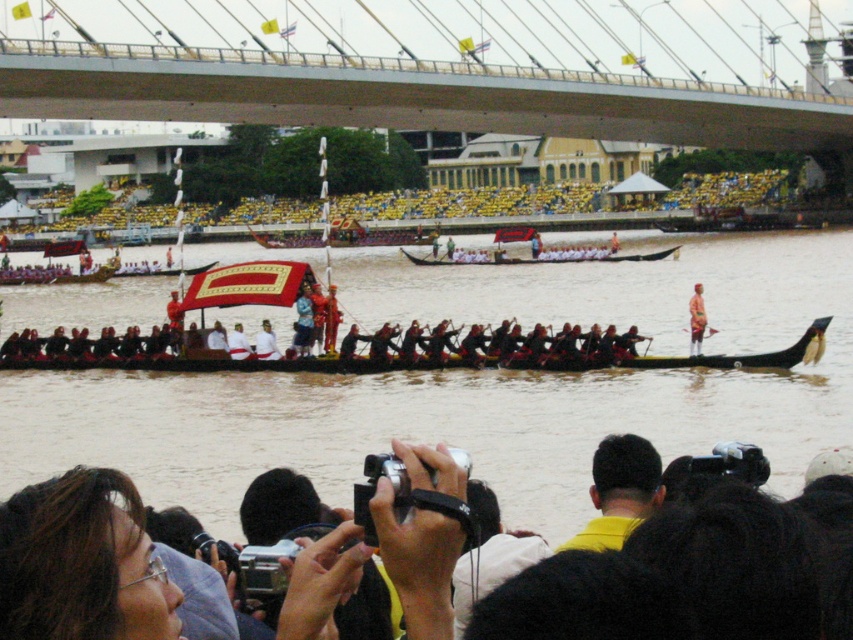
You are standing at the center of the bridge overlooking the river. You notice a person with dark brown hair at lower left. Where would you look to find this person?

The person with dark brown hair at lower left is located at point (x=50, y=552).

You are standing at the position of the viewer and want to take a photo of the dark brown hair at lower left. If your camera can focus on objects up to 150 feet away, will you be able to capture it clearly?

The dark brown hair at lower left and viewer are 151.35 feet apart, which is beyond the camera focus range of 150 feet. Therefore, the camera cannot focus on the dark brown hair at lower left clearly.